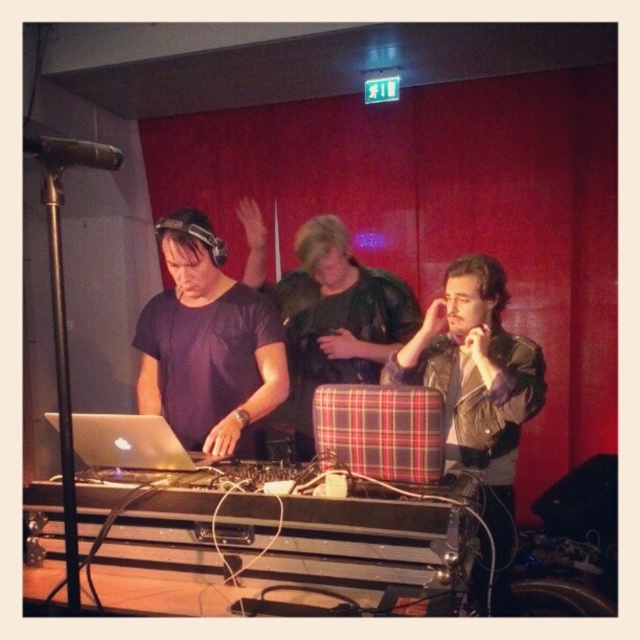
Does leather jacket at center appear on the right side of black matte microphone at upper left?

Indeed, leather jacket at center is positioned on the right side of black matte microphone at upper left.

Can you confirm if leather jacket at center is shorter than black matte microphone at upper left?

No, leather jacket at center is not shorter than black matte microphone at upper left.

Does point (499, 282) come in front of point (104, 160)?

That is False.

Locate an element on the screen. leather jacket at center is located at coordinates (477, 390).

From the picture: Between matte black shirt at center and leather jacket at center, which one has less height?

matte black shirt at center

Who is higher up, matte black shirt at center or leather jacket at center?

matte black shirt at center

Is point (230, 400) closer to viewer compared to point (468, 340)?

That is False.

Find the location of a particular element. The width and height of the screenshot is (640, 640). matte black shirt at center is located at coordinates (208, 344).

Between silver metallic laptop at left and black matte microphone at upper left, which one appears on the right side from the viewer's perspective?

From the viewer's perspective, silver metallic laptop at left appears more on the right side.

Is silver metallic laptop at left bigger than black matte microphone at upper left?

Yes.

Between point (80, 458) and point (92, 141), which one is positioned behind?

The point (80, 458) is behind.

Where is `silver metallic laptop at left`? silver metallic laptop at left is located at coordinates (131, 444).